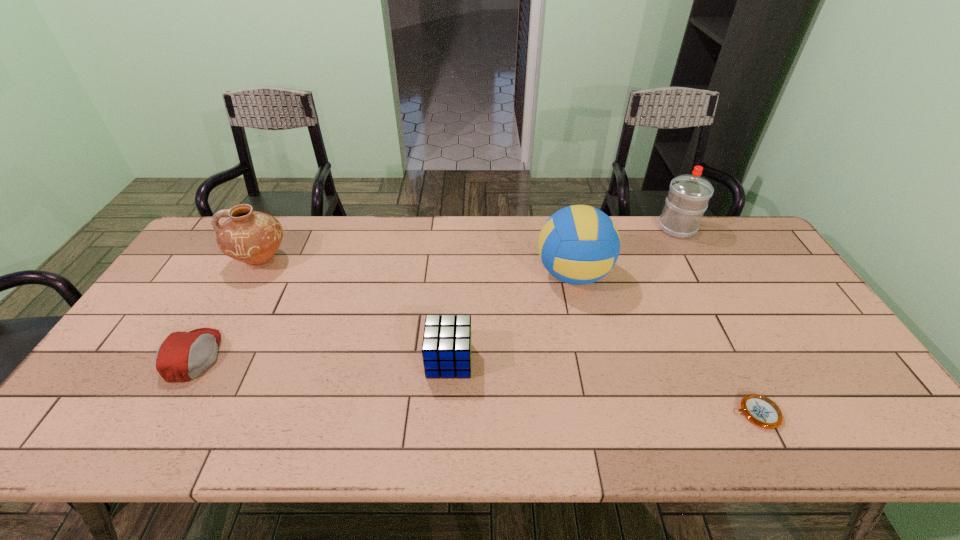
Where is `object positioned at the far left corner`? object positioned at the far left corner is located at coordinates (252, 237).

Where is `free space at the far edge of the desktop`? The width and height of the screenshot is (960, 540). free space at the far edge of the desktop is located at coordinates (633, 231).

You are a GUI agent. You are given a task and a screenshot of the screen. Output one action in this format:
    pyautogui.click(x=<x>, y=<y>)
    Task: Click on the vacant space at the near edge
    
    Given the screenshot: What is the action you would take?
    pyautogui.click(x=693, y=424)

This screenshot has width=960, height=540. I want to click on vacant space at the right edge of the desktop, so click(791, 324).

Find the location of a particular element. The width and height of the screenshot is (960, 540). vacant area that lies between the nearest object and the farthest object is located at coordinates (717, 320).

I want to click on blank region between the fourth shortest object and the third object from left to right, so click(x=355, y=310).

I want to click on empty space that is in between the pottery and the farthest object, so click(469, 244).

In order to click on vacant point located between the third tallest object and the compass in this screenshot , I will do `click(509, 337)`.

Identify the location of vacant space that is in between the volleyball and the fifth tallest object. The height and width of the screenshot is (540, 960). click(384, 315).

In order to click on free spot between the third object from left to right and the fourth shortest object in this screenshot , I will do `click(355, 310)`.